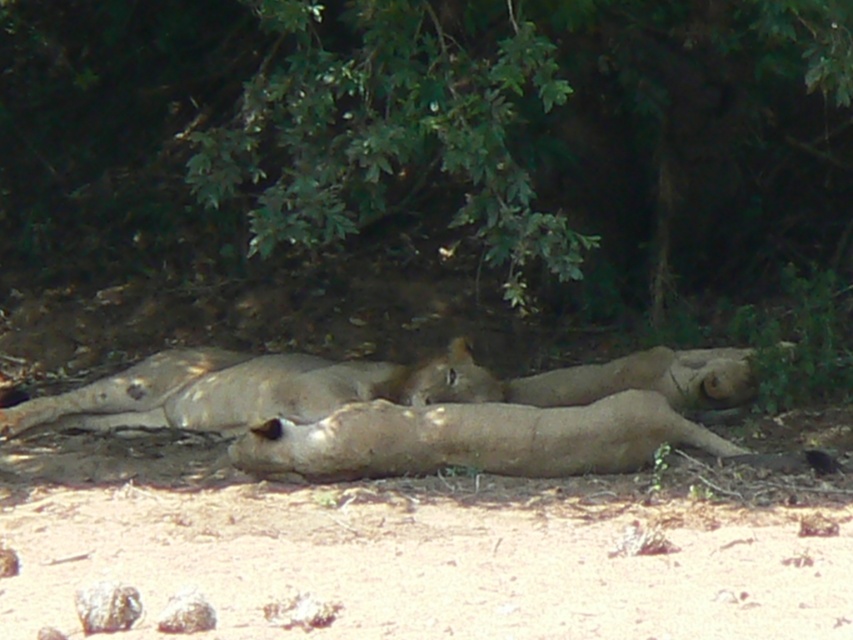
Does light brown fur at center have a greater height compared to light brown fur lion at center?

Incorrect, light brown fur at center's height is not larger of light brown fur lion at center's.

Is light brown fur at center shorter than light brown fur lion at center?

Yes, light brown fur at center is shorter than light brown fur lion at center.

Is point (350, 436) farther from viewer compared to point (54, 396)?

No, (350, 436) is closer to viewer.

What are the coordinates of `light brown fur at center` in the screenshot? It's located at (473, 440).

Which is more to the right, green leafy tree at upper center or light brown fur at center?

green leafy tree at upper center

Does point (653, 248) come behind point (624, 442)?

Yes, it is.

The image size is (853, 640). I want to click on green leafy tree at upper center, so click(x=521, y=116).

Find the location of a particular element. green leafy tree at upper center is located at coordinates (521, 116).

Does green leafy tree at upper center have a lesser height compared to light brown fur lion at center?

Incorrect, green leafy tree at upper center's height does not fall short of light brown fur lion at center's.

The height and width of the screenshot is (640, 853). What do you see at coordinates (521, 116) in the screenshot?
I see `green leafy tree at upper center` at bounding box center [521, 116].

Is point (744, 172) positioned behind point (442, 365)?

Yes.

The width and height of the screenshot is (853, 640). What are the coordinates of `green leafy tree at upper center` in the screenshot? It's located at (521, 116).